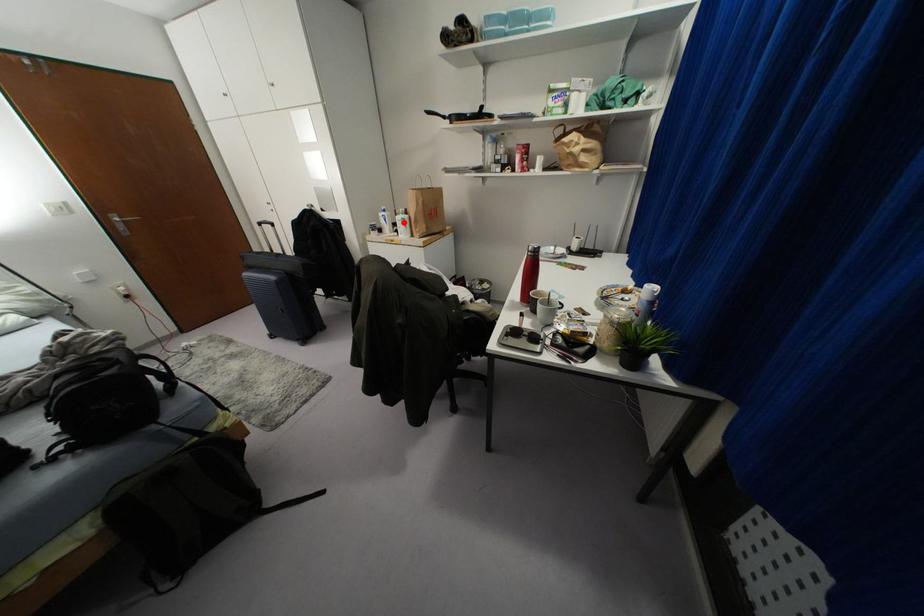
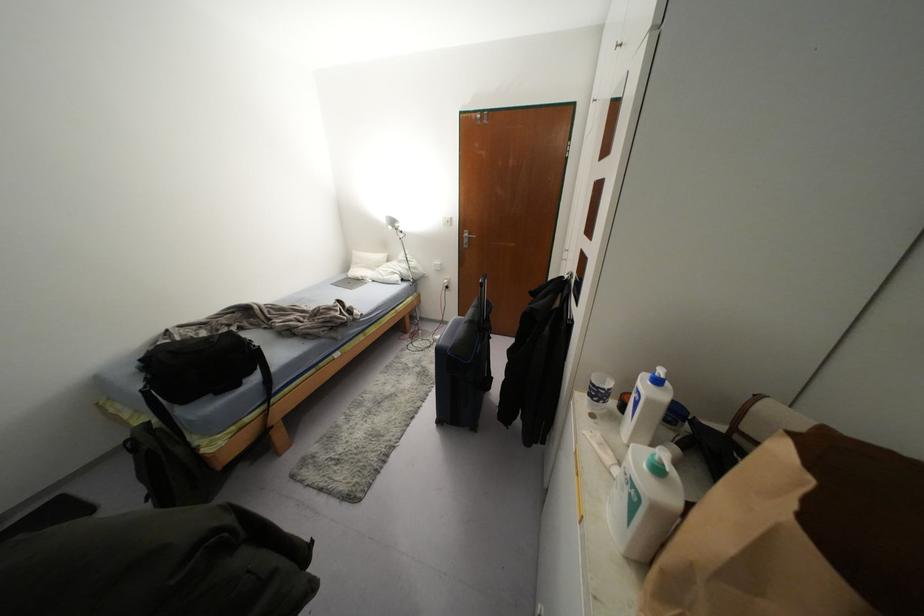
Locate, in the second image, the point that corresponds to the highlighted location in the first image.

(633, 505)